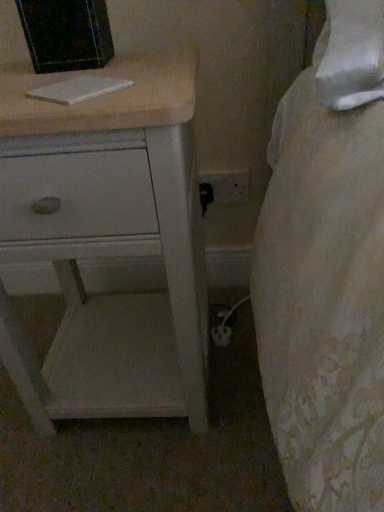
You are a GUI agent. You are given a task and a screenshot of the screen. Output one action in this format:
    pyautogui.click(x=<x>, y=<y>)
    Task: Click on the free space above white painted wood chest of drawers at left (from a real-world perspective)
    
    Given the screenshot: What is the action you would take?
    pyautogui.click(x=78, y=80)